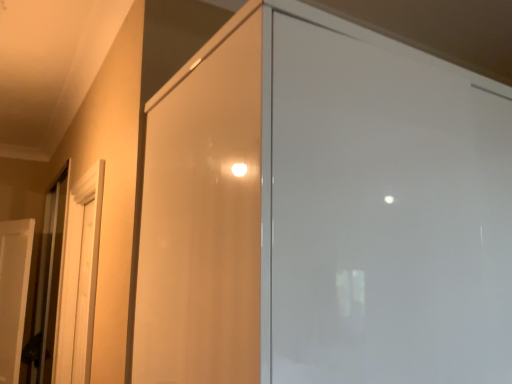
Question: Is matte wood screen door at left, the second screen door positioned from the front, shorter than transparent glass screen door at center, the first screen door in the right-to-left sequence?

Choices:
 (A) no
 (B) yes

Answer: (A)

Question: Can you confirm if matte wood screen door at left, the second screen door positioned from the front, is taller than transparent glass screen door at center, the first screen door positioned from the front?

Choices:
 (A) no
 (B) yes

Answer: (B)

Question: Is matte wood screen door at left, the second screen door when ordered from right to left, wider than transparent glass screen door at center, the first screen door in the right-to-left sequence?

Choices:
 (A) no
 (B) yes

Answer: (A)

Question: Is matte wood screen door at left, the 1th screen door positioned from the back, touching transparent glass screen door at center, the first screen door positioned from the front?

Choices:
 (A) yes
 (B) no

Answer: (B)

Question: Could transparent glass screen door at center, the first screen door positioned from the front, be considered to be inside matte wood screen door at left, the second screen door positioned from the front?

Choices:
 (A) yes
 (B) no

Answer: (B)

Question: From a real-world perspective, is matte wood screen door at left, the 1th screen door positioned from the back, physically above transparent glass screen door at center, the first screen door in the right-to-left sequence?

Choices:
 (A) yes
 (B) no

Answer: (B)

Question: Does metallic elevator door at left have a lesser height compared to white matte door at left?

Choices:
 (A) no
 (B) yes

Answer: (A)

Question: Is metallic elevator door at left aimed at white matte door at left?

Choices:
 (A) yes
 (B) no

Answer: (A)

Question: Is metallic elevator door at left smaller than white matte door at left?

Choices:
 (A) no
 (B) yes

Answer: (A)

Question: Are metallic elevator door at left and white matte door at left making contact?

Choices:
 (A) no
 (B) yes

Answer: (A)

Question: Can you confirm if metallic elevator door at left is taller than white matte door at left?

Choices:
 (A) no
 (B) yes

Answer: (B)

Question: From the image's perspective, is metallic elevator door at left on white matte door at left?

Choices:
 (A) no
 (B) yes

Answer: (B)

Question: Is transparent glass screen door at center, positioned as the second screen door in back-to-front order, not near metallic elevator door at left?

Choices:
 (A) yes
 (B) no

Answer: (A)